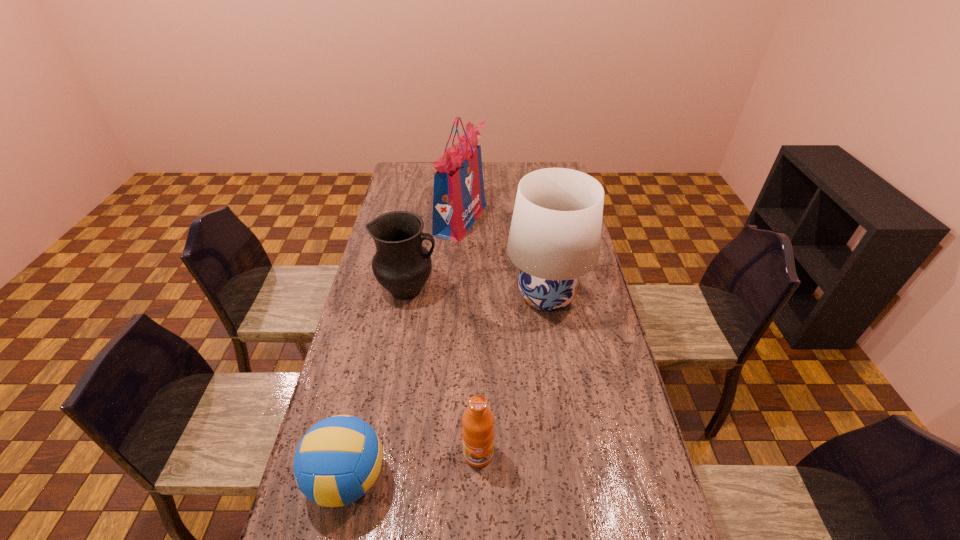
Find the location of a particular element. vacant space that satisfies the following two spatial constraints: 1. on the front-facing side of the rightmost object; 2. on the label side of the second shortest object is located at coordinates pos(571,454).